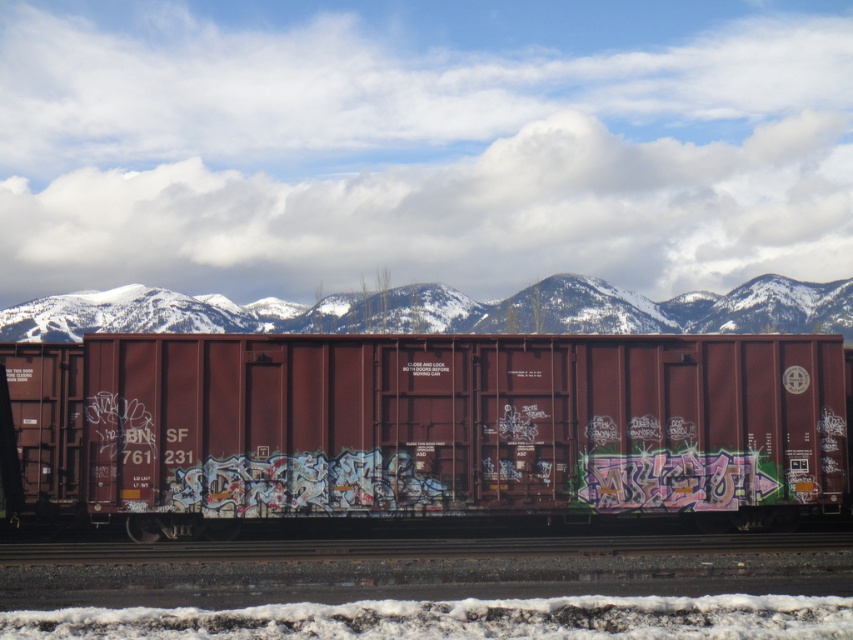
Is maroon matte freight car at center bigger than snowy mountains at upper center?

Actually, maroon matte freight car at center might be smaller than snowy mountains at upper center.

Between point (688, 474) and point (300, 324), which one is positioned behind?

Point (300, 324)

Identify the location of maroon matte freight car at center. The width and height of the screenshot is (853, 640). (428, 426).